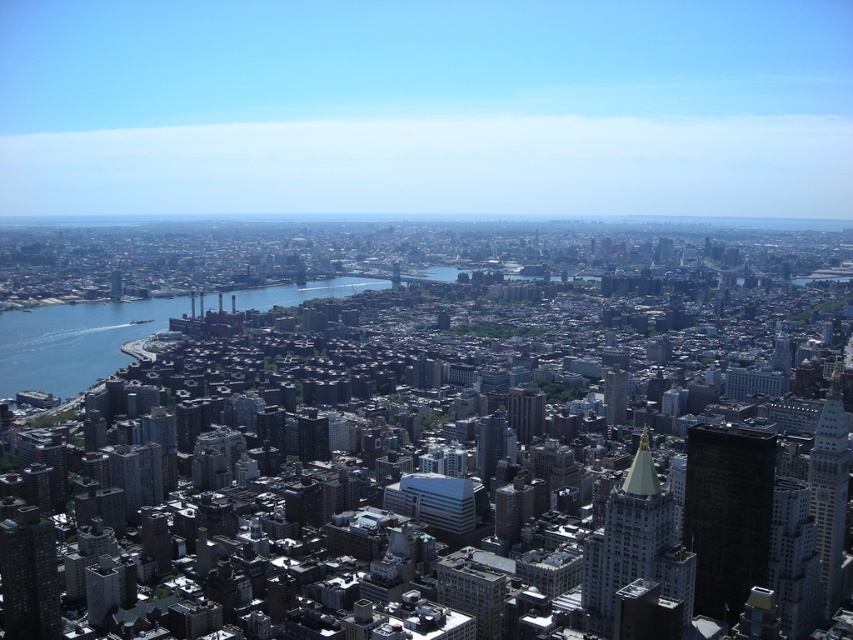
Question: Which point is farther from the camera taking this photo?

Choices:
 (A) (592, 627)
 (B) (21, 323)
 (C) (117, 296)
 (D) (605, 412)

Answer: (B)

Question: Is dark gray concrete skyscraper at lower left to the right of matte glass skyscraper at center from the viewer's perspective?

Choices:
 (A) no
 (B) yes

Answer: (A)

Question: Based on their relative distances, which object is farther from the matte gray building at lower left?

Choices:
 (A) dark gray concrete skyscraper at center
 (B) matte glass skyscraper at center
 (C) black glass building at right
 (D) blue liquid water at lower left

Answer: (C)

Question: Which object appears farthest from the camera in this image?

Choices:
 (A) dark gray concrete skyscraper at lower left
 (B) blue liquid water at lower left
 (C) dark gray concrete skyscraper at center

Answer: (A)

Question: Is dark gray concrete skyscraper at center bigger than matte glass skyscraper at center?

Choices:
 (A) yes
 (B) no

Answer: (A)

Question: Is blue liquid water at lower left to the left of gold polished stone tower at center from the viewer's perspective?

Choices:
 (A) yes
 (B) no

Answer: (A)